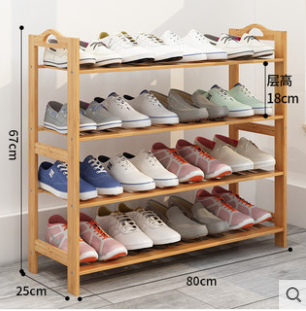
Locate an element on the screen. This screenshot has height=311, width=306. shoes on the second lowest shelf is located at coordinates (85, 191), (112, 185), (137, 177), (163, 171), (178, 168), (207, 162), (233, 155), (254, 150).